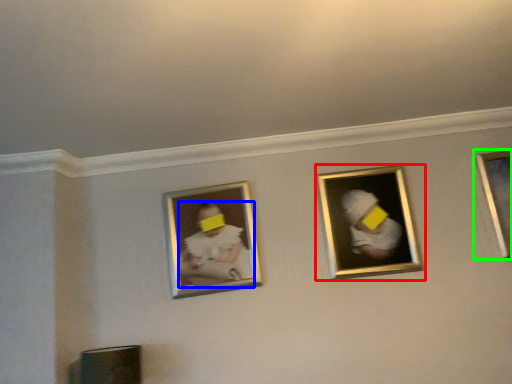
Question: Which object is the closest to the picture frame (highlighted by a red box)? Choose among these: person (highlighted by a blue box) or picture frame (highlighted by a green box).

Choices:
 (A) person
 (B) picture frame

Answer: (B)